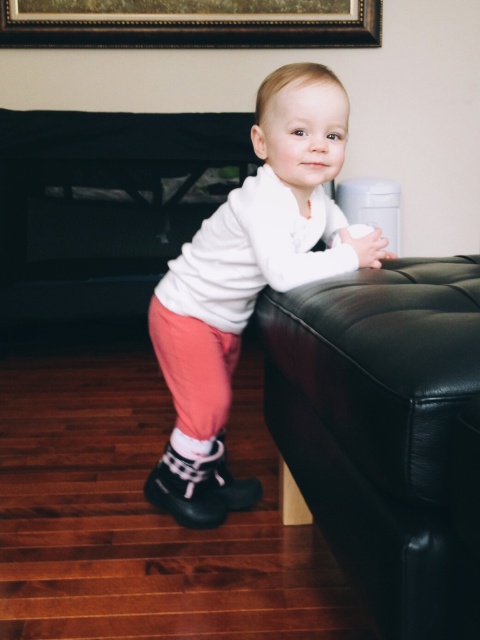
Question: Is black leather ottoman at right to the right of white soft sweater at center from the viewer's perspective?

Choices:
 (A) yes
 (B) no

Answer: (A)

Question: Which of the following is the closest to the observer?

Choices:
 (A) black leather ottoman at right
 (B) gold/black wood picture frame at upper center
 (C) white soft sweater at center

Answer: (A)

Question: Which of the following is the farthest from the observer?

Choices:
 (A) white soft sweater at center
 (B) black leather ottoman at right
 (C) gold/black wood picture frame at upper center

Answer: (C)

Question: Which object appears farthest from the camera in this image?

Choices:
 (A) gold/black wood picture frame at upper center
 (B) white soft sweater at center

Answer: (A)

Question: Considering the relative positions of black leather ottoman at right and white soft sweater at center in the image provided, where is black leather ottoman at right located with respect to white soft sweater at center?

Choices:
 (A) above
 (B) below

Answer: (B)

Question: Observing the image, what is the correct spatial positioning of white soft sweater at center in reference to gold/black wood picture frame at upper center?

Choices:
 (A) right
 (B) left

Answer: (A)